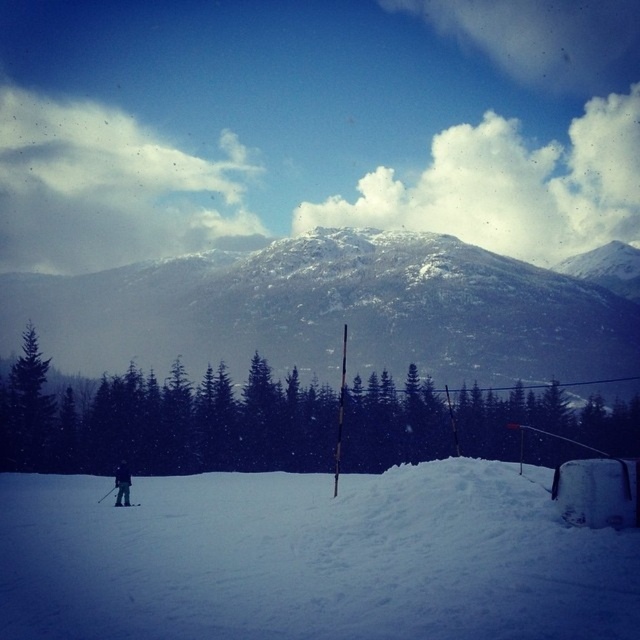
Between point (588, 592) and point (118, 468), which one is positioned behind?

Positioned behind is point (118, 468).

Between point (477, 509) and point (124, 464), which one is positioned in front?

Point (477, 509)

Who is more distant from viewer, (278,586) or (124,500)?

Point (124,500)

The width and height of the screenshot is (640, 640). What are the coordinates of `white powdery snow at lower left` in the screenshot? It's located at (310, 557).

The width and height of the screenshot is (640, 640). Identify the location of green matte tree at left. (26, 408).

How distant is green matte tree at left from dark blue ski suit at lower left?

21.19 meters

Is point (4, 458) farther from viewer compared to point (124, 468)?

That is True.

Locate an element on the screen. green matte tree at left is located at coordinates (26, 408).

From the picture: Can you confirm if green matte tree at left is thinner than black matte ski at lower left?

Incorrect, green matte tree at left's width is not less than black matte ski at lower left's.

Does green matte tree at left come behind black matte ski at lower left?

Yes, green matte tree at left is further from the viewer.

I want to click on green matte tree at left, so click(26, 408).